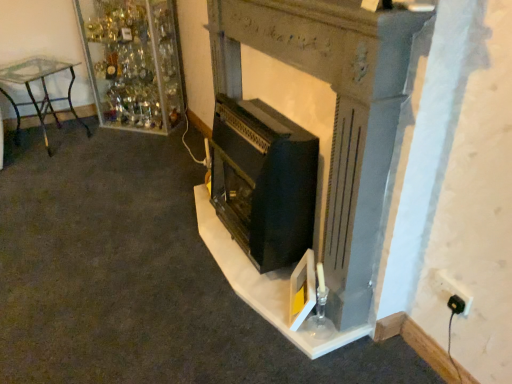
Image resolution: width=512 pixels, height=384 pixels. What do you see at coordinates (133, 62) in the screenshot?
I see `clear glass shelves at upper left` at bounding box center [133, 62].

What is the approximate height of matte black fireplace at center?

3.64 feet.

The width and height of the screenshot is (512, 384). Describe the element at coordinates (312, 151) in the screenshot. I see `matte black fireplace at center` at that location.

In order to click on clear glass table at left in this screenshot , I will do `click(42, 91)`.

Between clear glass shelves at upper left and matte black fireplace at center, which one appears on the right side from the viewer's perspective?

From the viewer's perspective, matte black fireplace at center appears more on the right side.

Which point is more distant from viewer, (106, 74) or (252, 305)?

The point (106, 74) is farther.

Are clear glass shelves at upper left and matte black fireplace at center located far from each other?

Yes, clear glass shelves at upper left and matte black fireplace at center are located far from each other.

From the image's perspective, is white plastic plug at lower right above or below matte black fireplace at center?

From the image's perspective, white plastic plug at lower right appears below matte black fireplace at center.

From a real-world perspective, is white plastic plug at lower right below matte black fireplace at center?

Yes, from a real-world perspective, white plastic plug at lower right is under matte black fireplace at center.

Between white plastic plug at lower right and matte black fireplace at center, which one appears on the left side from the viewer's perspective?

Positioned to the left is matte black fireplace at center.

Measure the distance from white plastic plug at lower right to matte black fireplace at center.

white plastic plug at lower right is 75.49 centimeters away from matte black fireplace at center.

What's the angular difference between black plastic plug at lower right and clear glass table at left's facing directions?

There is a 114-degree angle between the facing directions of black plastic plug at lower right and clear glass table at left.

You are a GUI agent. You are given a task and a screenshot of the screen. Output one action in this format:
    pyautogui.click(x=<x>, y=<y>)
    Task: Click on the furniture on the left of black plastic plug at lower right
    The height and width of the screenshot is (384, 512).
    Given the screenshot: What is the action you would take?
    pyautogui.click(x=42, y=91)

Is black plastic plug at lower right facing away from clear glass table at left?

black plastic plug at lower right does not have its back to clear glass table at left.

Between black plastic plug at lower right and clear glass table at left, which one has smaller size?

With smaller size is black plastic plug at lower right.

Based on the photo, is the depth of matte black fireplace at center less than that of clear glass shelves at upper left?

That is True.

Which is farther, (359, 204) or (96, 88)?

The point (96, 88) is behind.

Is matte black fireplace at center at the left side of clear glass shelves at upper left?

In fact, matte black fireplace at center is to the right of clear glass shelves at upper left.

Between white plastic plug at lower right and clear glass shelves at upper left, which one has larger size?

With larger size is clear glass shelves at upper left.

Relative to clear glass shelves at upper left, is white plastic plug at lower right in front or behind?

In the image, white plastic plug at lower right appears in front of clear glass shelves at upper left.

Is white plastic plug at lower right beside clear glass shelves at upper left?

No, white plastic plug at lower right is not making contact with clear glass shelves at upper left.

How distant is white plastic plug at lower right from clear glass shelves at upper left?

white plastic plug at lower right and clear glass shelves at upper left are 2.82 meters apart.

Is matte black fireplace at center surrounding black matte wood burning stove at center?

Yes, black matte wood burning stove at center is inside matte black fireplace at center.

Locate an element on the screen. Image resolution: width=512 pixels, height=384 pixels. wood burning stove below the matte black fireplace at center (from a real-world perspective) is located at coordinates (263, 181).

Is matte black fireplace at center oriented away from black matte wood burning stove at center?

Yes, matte black fireplace at center's orientation is away from black matte wood burning stove at center.

Between matte black fireplace at center and black matte wood burning stove at center, which one is positioned in front?

matte black fireplace at center is in front.

From a real-world perspective, who is located lower, clear glass shelves at upper left or black plastic plug at lower right?

black plastic plug at lower right is physically lower.

Is clear glass shelves at upper left positioned with its back to black plastic plug at lower right?

No, black plastic plug at lower right is not at the back of clear glass shelves at upper left.

Does point (145, 34) come closer to viewer compared to point (459, 312)?

That is False.

In the scene shown: Can you confirm if clear glass shelves at upper left is bigger than black plastic plug at lower right?

Answer: Yes.

At what (x,y) coordinates should I click in order to perform the action: click on shelf on the left of matte black fireplace at center. Please return your answer as a coordinate pair (x, y). The width and height of the screenshot is (512, 384). Looking at the image, I should click on (133, 62).

This screenshot has height=384, width=512. I want to click on electric outlet behind the matte black fireplace at center, so click(x=453, y=288).

Based on their spatial positions, is matte black fireplace at center or white plastic plug at lower right closer to clear glass table at left?

Among the two, matte black fireplace at center is located nearer to clear glass table at left.

When comparing their distances from matte black fireplace at center, does black matte wood burning stove at center or clear glass shelves at upper left seem closer?

Based on the image, black matte wood burning stove at center appears to be nearer to matte black fireplace at center.

Looking at the image, which one is located closer to white plastic plug at lower right, black matte wood burning stove at center or black plastic plug at lower right?

Among the two, black plastic plug at lower right is located nearer to white plastic plug at lower right.

When comparing their distances from white plastic plug at lower right, does matte black fireplace at center or clear glass table at left seem closer?

The object closer to white plastic plug at lower right is matte black fireplace at center.

Which object lies further to the anchor point clear glass table at left, black matte wood burning stove at center or matte black fireplace at center?

matte black fireplace at center.

From the image, which object appears to be nearer to black plastic plug at lower right, clear glass shelves at upper left or matte black fireplace at center?

matte black fireplace at center.

From the image, which object appears to be farther from black plastic plug at lower right, matte black fireplace at center or clear glass shelves at upper left?

clear glass shelves at upper left lies further to black plastic plug at lower right than the other object.

When comparing their distances from black matte wood burning stove at center, does black plastic plug at lower right or clear glass table at left seem further?

Based on the image, clear glass table at left appears to be further to black matte wood burning stove at center.

Locate an element on the screen. This screenshot has width=512, height=384. furniture positioned between matte black fireplace at center and clear glass shelves at upper left from near to far is located at coordinates (42, 91).

Where is `wood burning stove between clear glass table at left and matte black fireplace at center`? The height and width of the screenshot is (384, 512). wood burning stove between clear glass table at left and matte black fireplace at center is located at coordinates (263, 181).

Locate an element on the screen. wood burning stove between black plastic plug at lower right and clear glass shelves at upper left in the front-back direction is located at coordinates (263, 181).

Identify the location of wood burning stove between white plastic plug at lower right and clear glass shelves at upper left from front to back. The height and width of the screenshot is (384, 512). (263, 181).